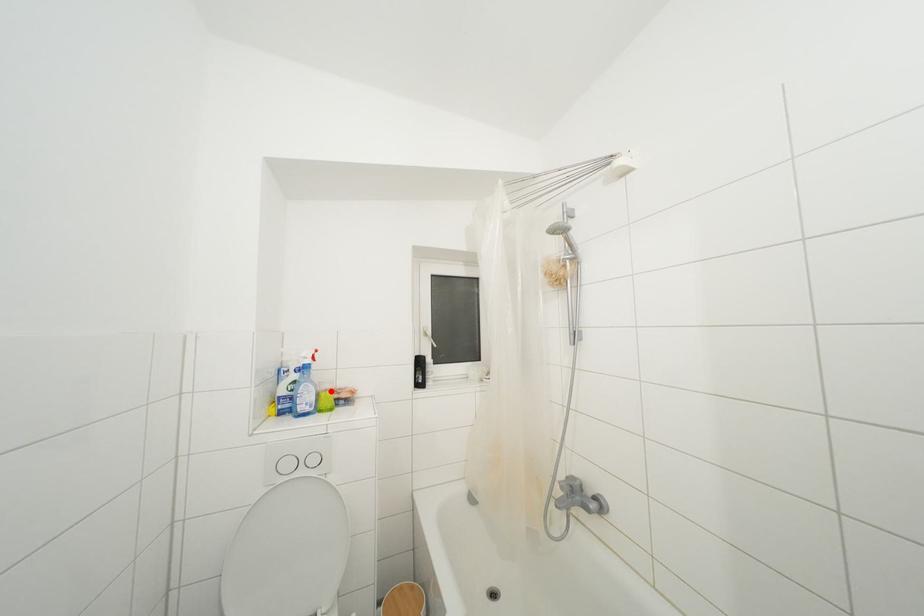
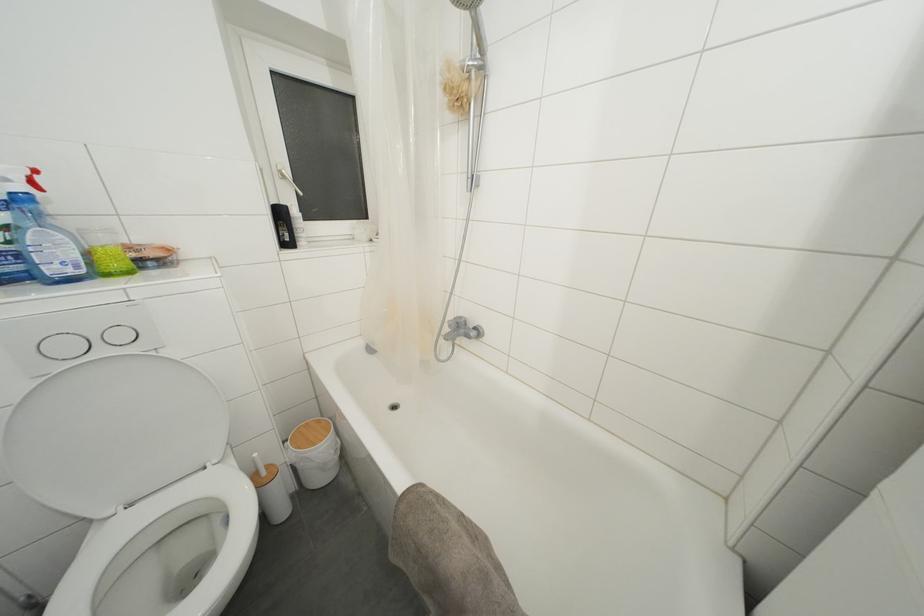
Locate, in the second image, the point that corresponds to the highlighted location in the first image.

(108, 245)